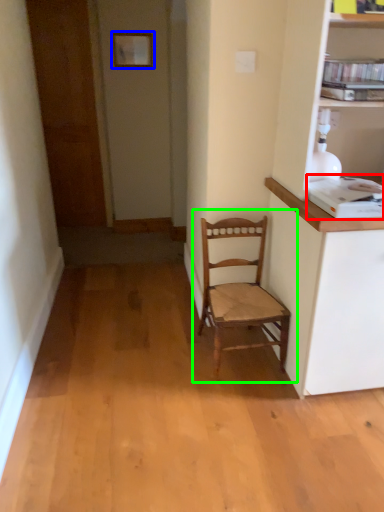
Question: Considering the real-world distances, which object is closest to appliance (highlighted by a red box)? picture frame (highlighted by a blue box) or chair (highlighted by a green box).

Choices:
 (A) picture frame
 (B) chair

Answer: (B)